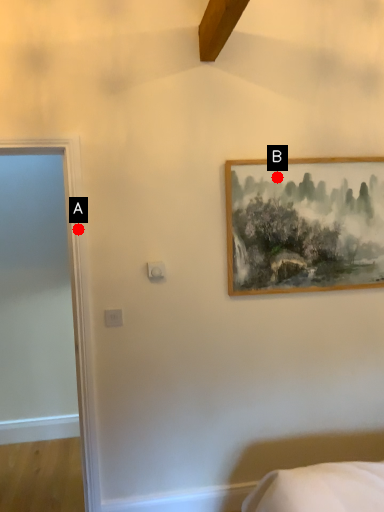
Question: Two points are circled on the image, labeled by A and B beside each circle. Which point is farther to the camera?

Choices:
 (A) A is further
 (B) B is further

Answer: (B)